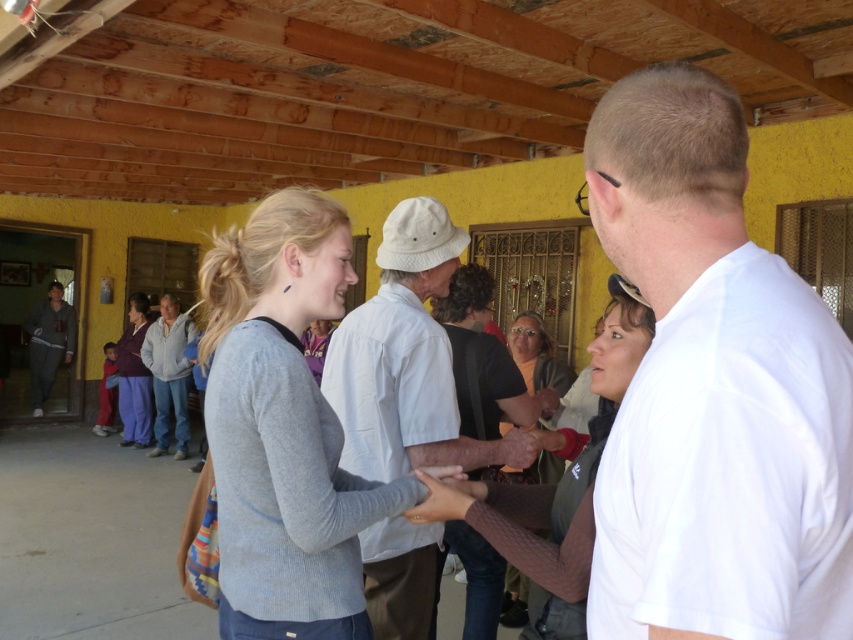
Question: Is brown textured sweater at center smaller than light gray sweater at left?

Choices:
 (A) no
 (B) yes

Answer: (B)

Question: Which point is farther to the camera?

Choices:
 (A) (664, 518)
 (B) (259, 253)

Answer: (B)

Question: Is the position of white matte shirt at center less distant than that of purple fabric pants at left?

Choices:
 (A) yes
 (B) no

Answer: (A)

Question: Which of the following is the closest to the observer?

Choices:
 (A) white cotton shirt at center
 (B) matte gray sweater at center
 (C) purple fabric pants at left

Answer: (A)

Question: Does brown textured sweater at center have a greater width compared to purple fabric pants at left?

Choices:
 (A) yes
 (B) no

Answer: (A)

Question: Estimate the real-world distances between objects in this image. Which object is closer to the purple fabric pants at left?

Choices:
 (A) white cotton shirt at center
 (B) matte gray sweater at center
 (C) gray sweatpants at left

Answer: (C)